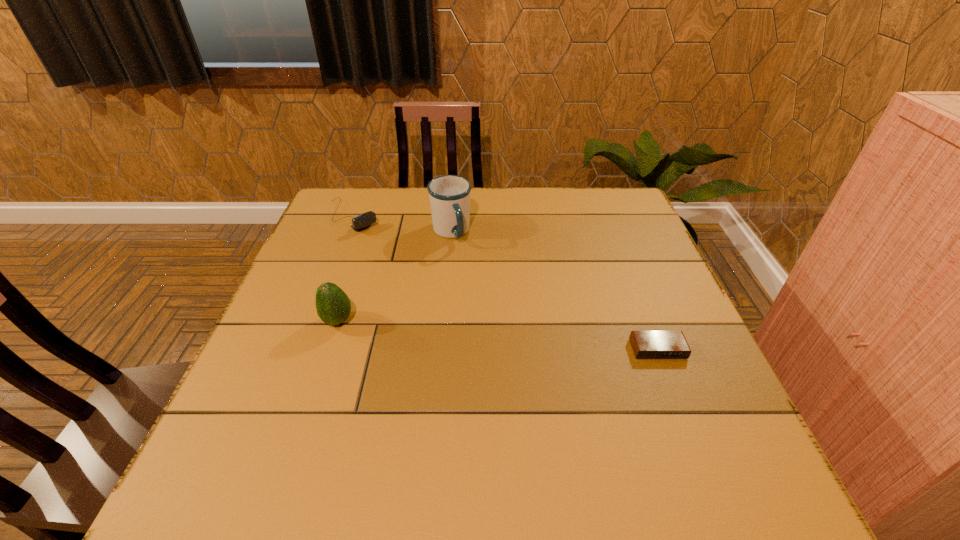
The image size is (960, 540). In order to click on vacant space that satisfies the following two spatial constraints: 1. on the front side of the third tallest object; 2. on the left side of the third shortest object in this screenshot , I will do `click(311, 321)`.